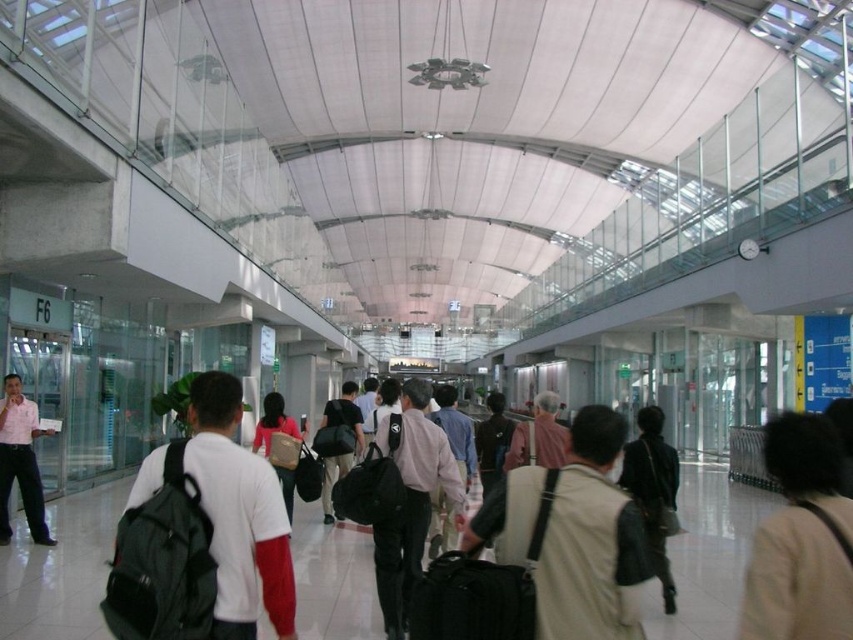
Question: Is black fabric suitcase at center to the right of light pink fabric at center from the viewer's perspective?

Choices:
 (A) yes
 (B) no

Answer: (B)

Question: Which object is the farthest from the dark gray backpack at center?

Choices:
 (A) beige fabric coat at lower right
 (B) black fabric suitcase at center
 (C) light pink fabric at center

Answer: (A)

Question: Among these points, which one is nearest to the camera?

Choices:
 (A) (518, 444)
 (B) (247, 496)

Answer: (B)

Question: Which object is farther from the camera taking this photo?

Choices:
 (A) beige fabric vest at center
 (B) matte black backpack at center
 (C) matte pink shirt at left

Answer: (C)

Question: In this image, where is black fabric suitcase at center located relative to matte brown bag at center?

Choices:
 (A) above
 (B) below

Answer: (B)

Question: Can you confirm if dark gray backpack at center is positioned below light pink fabric at center?

Choices:
 (A) no
 (B) yes

Answer: (A)